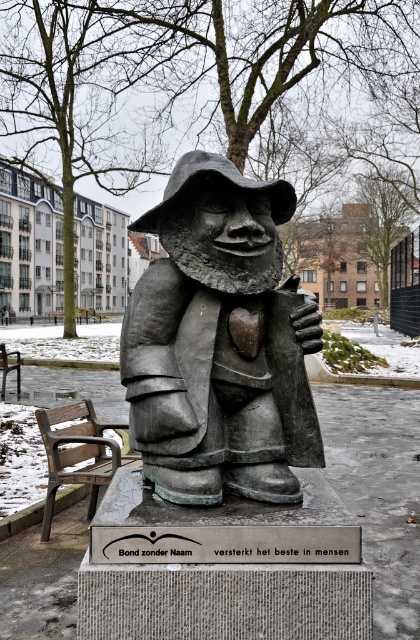
Question: Among these objects, which one is farthest from the camera?

Choices:
 (A) bronze statue at center
 (B) wooden park bench at lower left

Answer: (B)

Question: Can you confirm if bronze statue at center is smaller than wooden bench at lower left?

Choices:
 (A) no
 (B) yes

Answer: (B)

Question: In this image, where is bronze statue at center located relative to wooden park bench at lower left?

Choices:
 (A) right
 (B) left

Answer: (A)

Question: Where is wooden bench at lower left located in relation to wooden park bench at lower left in the image?

Choices:
 (A) left
 (B) right

Answer: (B)

Question: Which point is farther from the camera taking this photo?

Choices:
 (A) (315, 435)
 (B) (0, 388)

Answer: (B)

Question: Among these objects, which one is farthest from the camera?

Choices:
 (A) bronze statue at center
 (B) wooden park bench at lower left
 (C) wooden bench at lower left

Answer: (B)